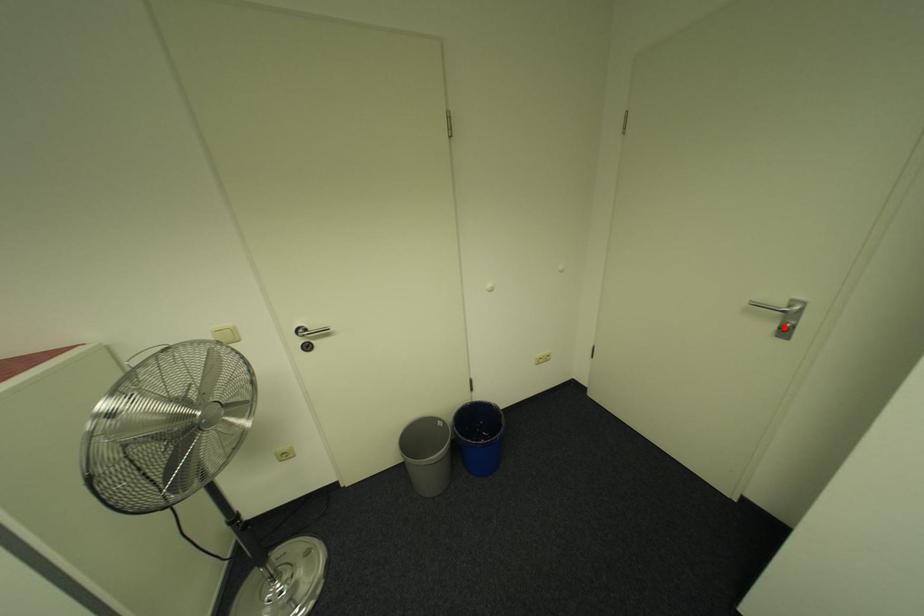
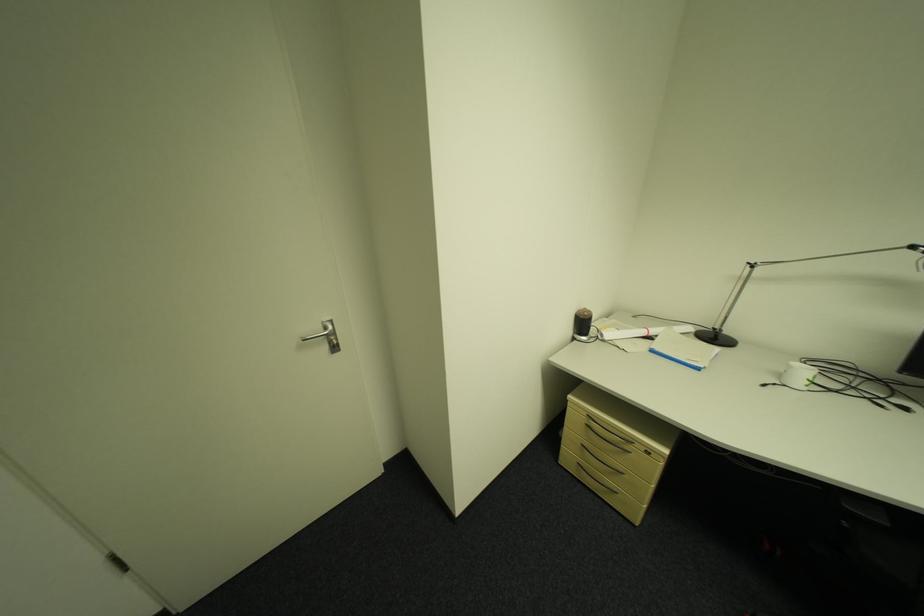
Find the pixel in the second image that matches the highlighted location in the first image.

(335, 349)